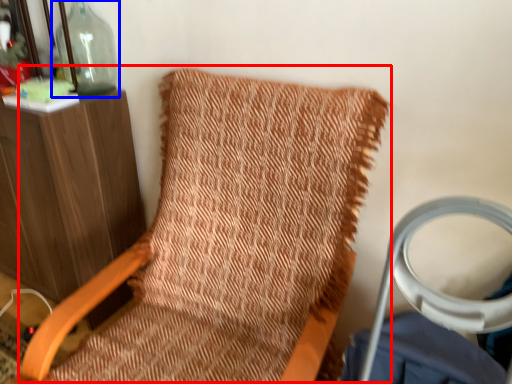
Question: Which point is further to the camera, bean bag chair (highlighted by a red box) or bottle (highlighted by a blue box)?

Choices:
 (A) bean bag chair
 (B) bottle

Answer: (B)